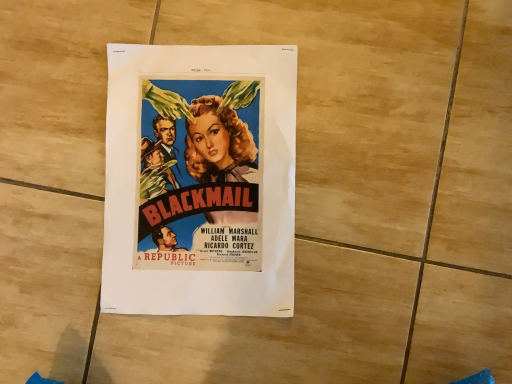
This screenshot has height=384, width=512. Describe the element at coordinates (200, 180) in the screenshot. I see `matte paper poster at center` at that location.

This screenshot has width=512, height=384. In order to click on matte paper poster at center in this screenshot , I will do `click(200, 180)`.

Find the location of a particular element. The image size is (512, 384). matte paper poster at center is located at coordinates (200, 180).